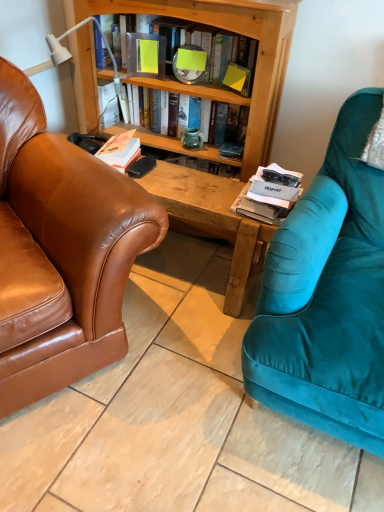
Question: Are matte plastic book at upper center, the first book when ordered from top to bottom, and white paper magazine at center located far from each other?

Choices:
 (A) yes
 (B) no

Answer: (B)

Question: From a real-world perspective, is matte plastic book at upper center, the third book in the bottom-to-top sequence, located higher than white paper magazine at center?

Choices:
 (A) no
 (B) yes

Answer: (B)

Question: From a real-world perspective, is matte plastic book at upper center, the third book in the bottom-to-top sequence, beneath white paper magazine at center?

Choices:
 (A) no
 (B) yes

Answer: (A)

Question: Is matte plastic book at upper center, the third book in the bottom-to-top sequence, smaller than white paper magazine at center?

Choices:
 (A) no
 (B) yes

Answer: (A)

Question: Is matte plastic book at upper center, the first book when ordered from top to bottom, further to the viewer compared to white paper magazine at center?

Choices:
 (A) no
 (B) yes

Answer: (B)

Question: Is matte plastic book at upper center, the first book when ordered from top to bottom, closer to the viewer compared to white paper magazine at center?

Choices:
 (A) no
 (B) yes

Answer: (A)

Question: Can you confirm if hardcover book at center, which is counted as the second book, starting from the bottom, is taller than matte plastic book at upper center, the third book in the bottom-to-top sequence?

Choices:
 (A) yes
 (B) no

Answer: (B)

Question: From a real-world perspective, is hardcover book at center, which is counted as the second book, starting from the bottom, physically below matte plastic book at upper center, the first book when ordered from top to bottom?

Choices:
 (A) no
 (B) yes

Answer: (B)

Question: Is hardcover book at center, which is counted as the second book, starting from the bottom, next to matte plastic book at upper center, the first book when ordered from top to bottom, and touching it?

Choices:
 (A) yes
 (B) no

Answer: (B)

Question: Is hardcover book at center, which is counted as the second book, starting from the bottom, at the left side of matte plastic book at upper center, the third book in the bottom-to-top sequence?

Choices:
 (A) yes
 (B) no

Answer: (A)

Question: Considering the relative positions of hardcover book at center, acting as the 2th book starting from the top, and matte plastic book at upper center, the third book in the bottom-to-top sequence, in the image provided, is hardcover book at center, acting as the 2th book starting from the top, to the right of matte plastic book at upper center, the third book in the bottom-to-top sequence, from the viewer's perspective?

Choices:
 (A) yes
 (B) no

Answer: (B)

Question: Is hardcover book at center, acting as the 2th book starting from the top, looking in the opposite direction of matte plastic book at upper center, the third book in the bottom-to-top sequence?

Choices:
 (A) no
 (B) yes

Answer: (A)

Question: Is white matte book at center, the third book when ordered from top to bottom, completely or partially inside teal glass vase at center?

Choices:
 (A) no
 (B) yes

Answer: (A)